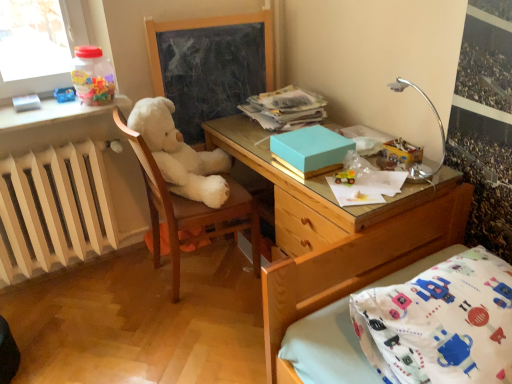
Where is `free space that is to the left of yellow rubber toy car at center, the 2th toy in the back-to-front sequence`? Image resolution: width=512 pixels, height=384 pixels. free space that is to the left of yellow rubber toy car at center, the 2th toy in the back-to-front sequence is located at coordinates (315, 182).